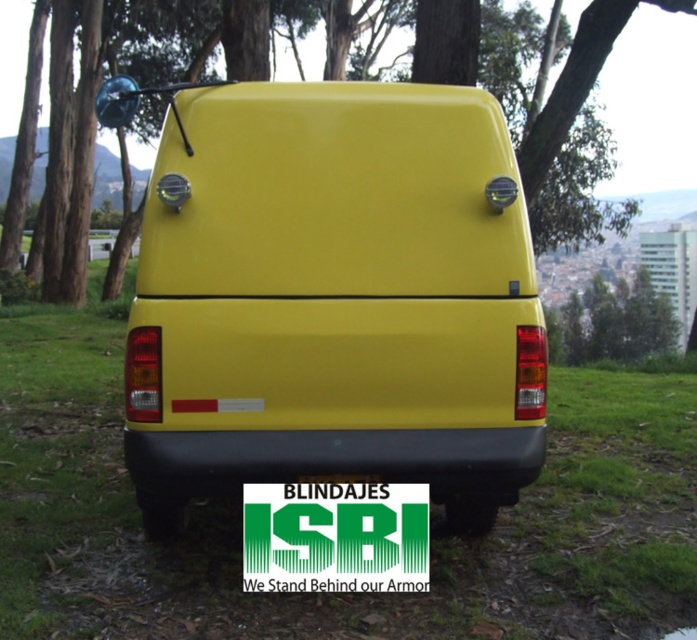
You are standing at the point labeled as point (434,497). You want to take a photo of the van with the city in the background. Is the distance between you and the camera sufficient to capture both the van and the city in the same frame?

The distance between point (434,497) and the camera is 12.89 feet. Since the van and city are both in the background, this distance should allow the camera to capture both in the same frame.

You are a delivery driver who needs to attach a GPS tracker to the object that is shorter between the green matte sign at center and the green matte tree at upper center. Which object should you choose?

The green matte sign at center is shorter than the green matte tree at upper center, so you should attach the GPS tracker to the green matte sign at center.

What are the coordinates of the matte yellow van at center?

The matte yellow van at center is located at point (335, 300).